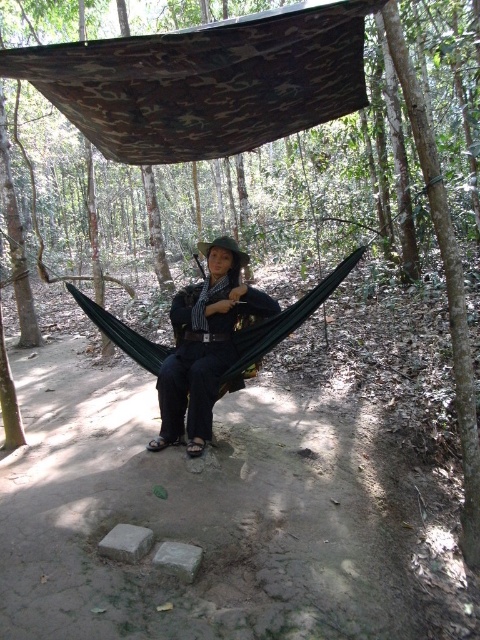
Question: Which of the following is the closest to the observer?

Choices:
 (A) dark blue fabric hammock at center
 (B) camo fabric hammock at upper center

Answer: (B)

Question: Can you confirm if camo fabric hammock at upper center is positioned above dark blue fabric hammock at center?

Choices:
 (A) yes
 (B) no

Answer: (A)

Question: Does camo fabric hammock at upper center lie behind dark blue fabric hammock at center?

Choices:
 (A) no
 (B) yes

Answer: (A)

Question: Which of the following is the farthest from the observer?

Choices:
 (A) dark blue fabric hammock at center
 (B) camo fabric hammock at upper center

Answer: (A)

Question: In this image, where is camo fabric hammock at upper center located relative to dark blue fabric hammock at center?

Choices:
 (A) above
 (B) below

Answer: (A)